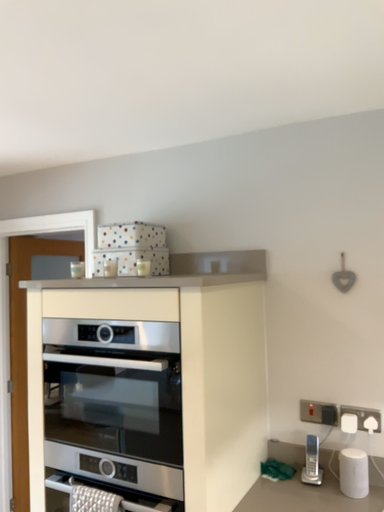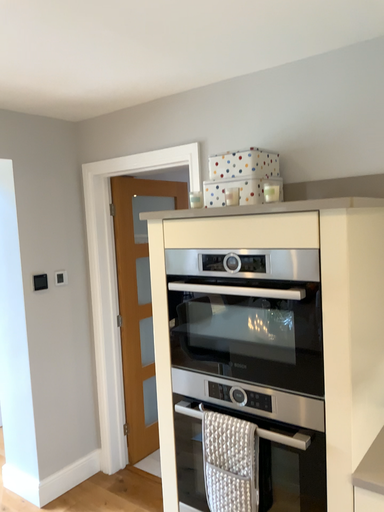
Question: How did the camera likely rotate when shooting the video?

Choices:
 (A) rotated left
 (B) rotated right

Answer: (A)